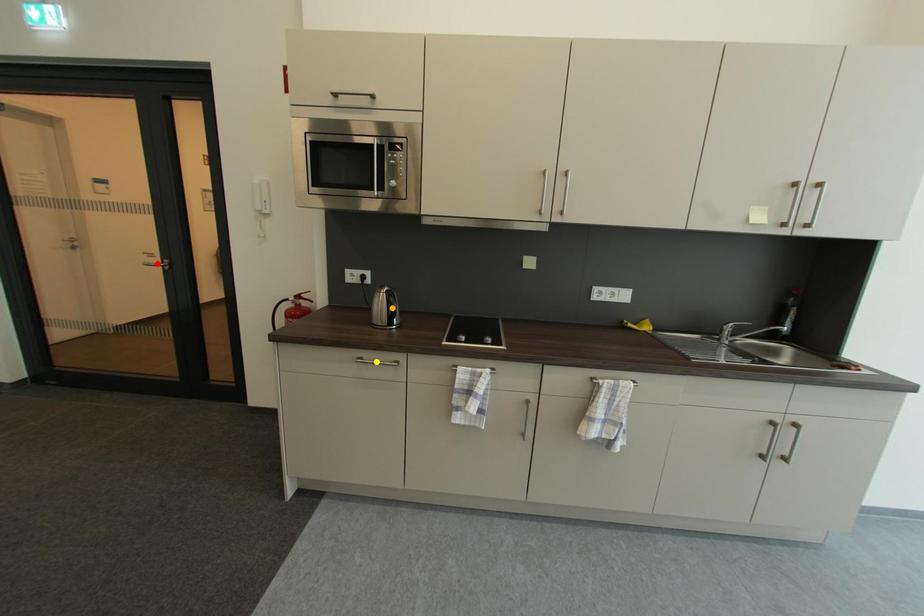
Order these from nearest to farthest:
- orange point
- yellow point
- red point

yellow point < orange point < red point